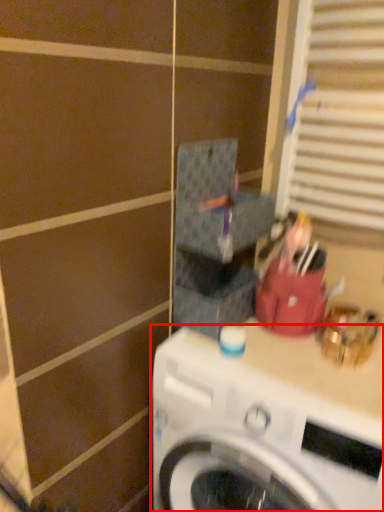
Question: From the image's perspective, considering the relative positions of washing machine (annotated by the red box) and window in the image provided, where is washing machine (annotated by the red box) located with respect to the staircase?

Choices:
 (A) below
 (B) above

Answer: (A)